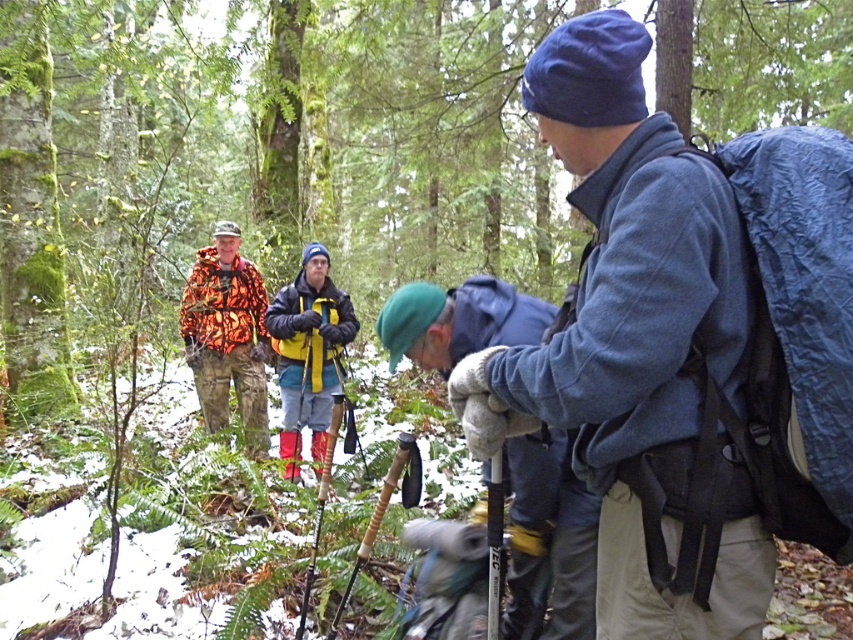
Question: Is blue woolen hat at center positioned at the back of yellow fabric backpack at center?

Choices:
 (A) no
 (B) yes

Answer: (A)

Question: Does blue woolen hat at center have a larger size compared to yellow fabric backpack at center?

Choices:
 (A) no
 (B) yes

Answer: (A)

Question: Which is farther from the blue fleece jacket at center?

Choices:
 (A) yellow fabric backpack at center
 (B) blue woolen hat at center

Answer: (A)

Question: Which point is farther from the camera taking this photo?

Choices:
 (A) (454, 360)
 (B) (727, 182)

Answer: (A)

Question: Is blue fleece jacket at center wider than blue woolen hat at center?

Choices:
 (A) yes
 (B) no

Answer: (A)

Question: Estimate the real-world distances between objects in this image. Which object is closer to the blue fleece jacket at center?

Choices:
 (A) blue woolen hat at center
 (B) yellow fabric backpack at center
 (C) camouflage fabric jacket at left

Answer: (A)